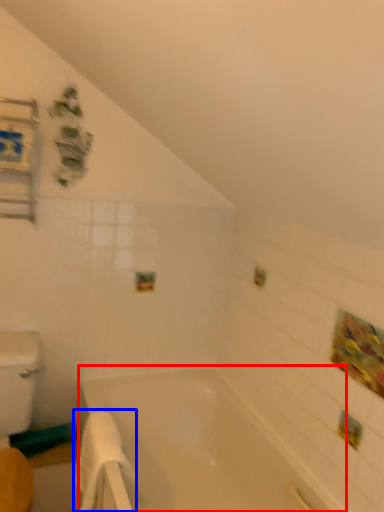
Question: Among these objects, which one is nearest to the camera, bathtub (highlighted by a red box) or bath towel (highlighted by a blue box)?

Choices:
 (A) bathtub
 (B) bath towel

Answer: (A)